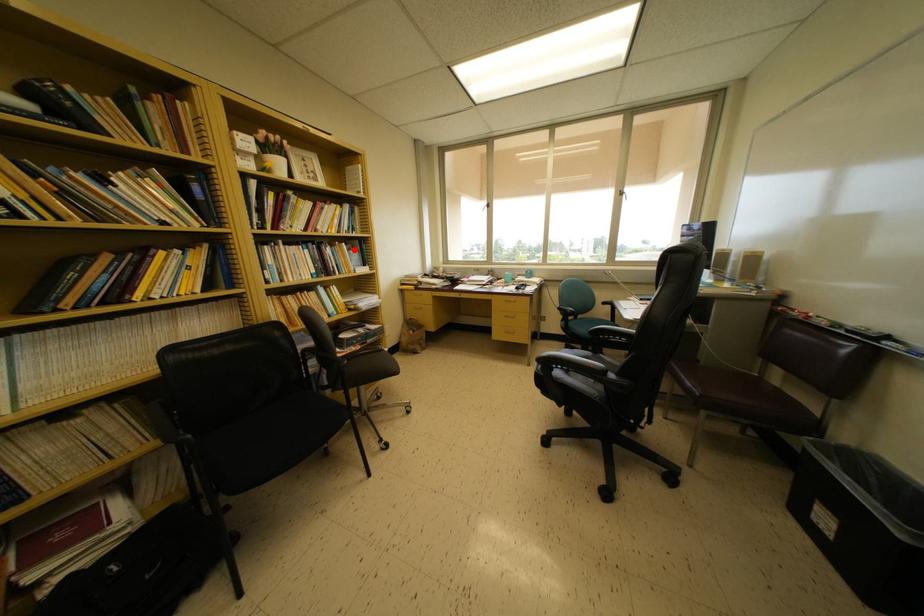
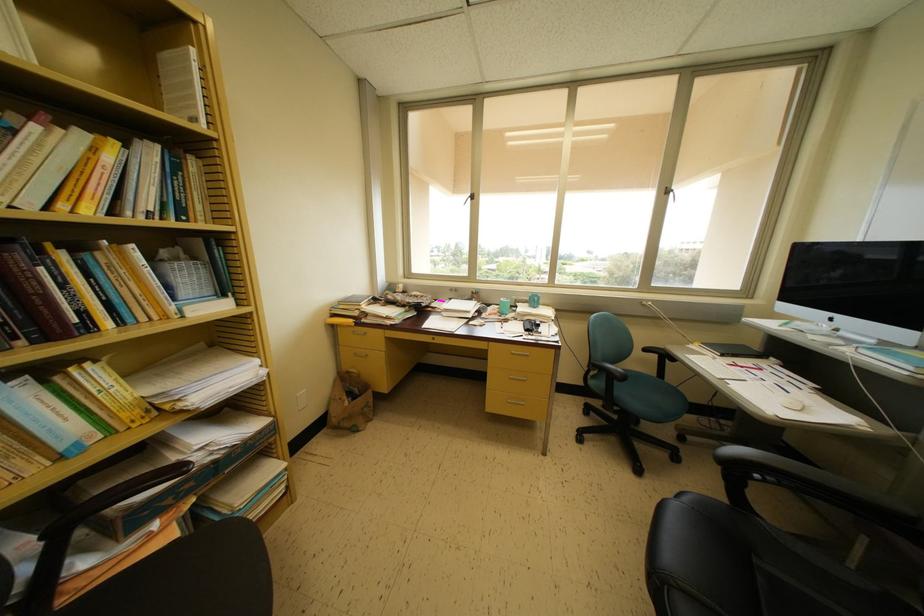
The point at the highlighted location is marked in the first image. Where is the corresponding point in the second image?

(181, 253)